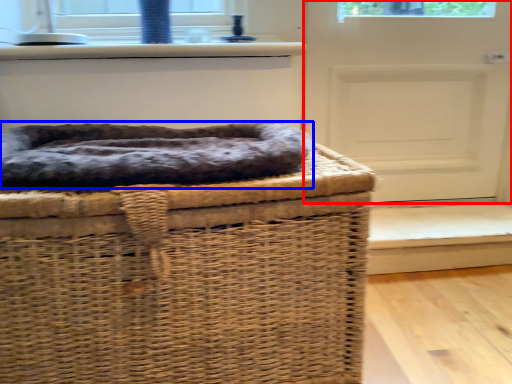
Question: Which point is closer to the camera, door (highlighted by a red box) or dog bed (highlighted by a blue box)?

Choices:
 (A) door
 (B) dog bed

Answer: (B)